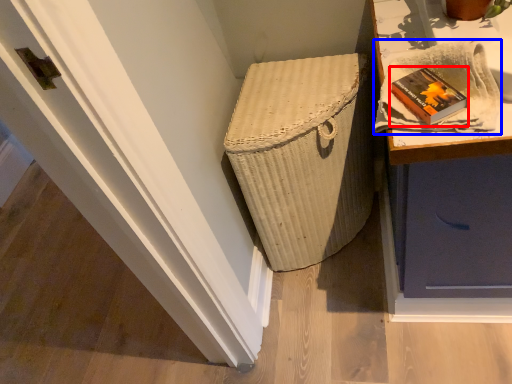
Question: Among these objects, which one is nearest to the camera, book (highlighted by a red box) or cloth (highlighted by a blue box)?

Choices:
 (A) book
 (B) cloth

Answer: (B)